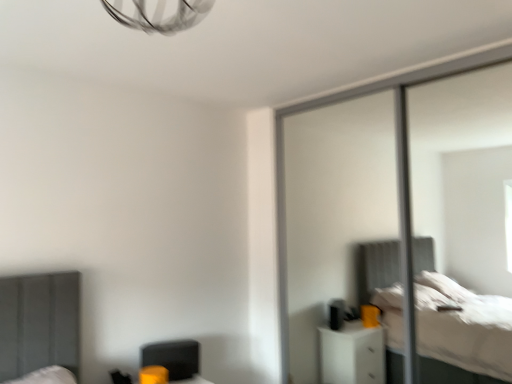
Question: Is transparent glass screen door at right in front of or behind matte black swivel chair at lower left in the image?

Choices:
 (A) front
 (B) behind

Answer: (A)

Question: In terms of width, does transparent glass screen door at right look wider or thinner when compared to matte black swivel chair at lower left?

Choices:
 (A) thin
 (B) wide

Answer: (B)

Question: Is transparent glass screen door at right inside the boundaries of matte black swivel chair at lower left, or outside?

Choices:
 (A) inside
 (B) outside

Answer: (B)

Question: Looking at the image, does matte black swivel chair at lower left seem bigger or smaller compared to transparent glass screen door at right?

Choices:
 (A) big
 (B) small

Answer: (B)

Question: In terms of height, does matte black swivel chair at lower left look taller or shorter compared to transparent glass screen door at right?

Choices:
 (A) short
 (B) tall

Answer: (A)

Question: From a real-world perspective, is matte black swivel chair at lower left above or below transparent glass screen door at right?

Choices:
 (A) below
 (B) above

Answer: (A)

Question: In the image, is matte black swivel chair at lower left on the left side or the right side of transparent glass screen door at right?

Choices:
 (A) right
 (B) left

Answer: (B)